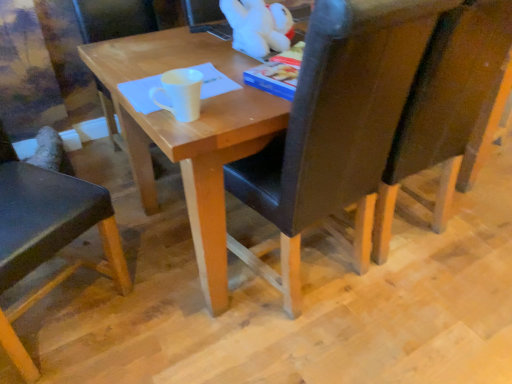
Image resolution: width=512 pixels, height=384 pixels. What do you see at coordinates (335, 130) in the screenshot?
I see `black leather chair at center, which is counted as the second chair, starting from the right` at bounding box center [335, 130].

Where is `matte wood chair at center, which ranks as the second chair in left-to-right order`? The image size is (512, 384). matte wood chair at center, which ranks as the second chair in left-to-right order is located at coordinates (125, 17).

Locate an element on the screen. dark brown leather chair at right, the first chair when ordered from right to left is located at coordinates (444, 108).

Can you confirm if white matte mug at center is bigger than matte wood chair at center, arranged as the 3th chair when viewed from the right?

Incorrect, white matte mug at center is not larger than matte wood chair at center, arranged as the 3th chair when viewed from the right.

Which object is positioned more to the left, white matte mug at center or matte wood chair at center, which ranks as the second chair in left-to-right order?

matte wood chair at center, which ranks as the second chair in left-to-right order, is more to the left.

What's the angular difference between white matte mug at center and matte wood chair at center, arranged as the 3th chair when viewed from the right,'s facing directions?

The angular difference between white matte mug at center and matte wood chair at center, arranged as the 3th chair when viewed from the right, is 86.4 degrees.

Is white matte mug at center completely or partially outside of matte wood chair at center, which ranks as the second chair in left-to-right order?

white matte mug at center is positioned outside matte wood chair at center, which ranks as the second chair in left-to-right order.

Who is bigger, matte wood chair at center, which ranks as the second chair in left-to-right order, or white matte mug at center?

matte wood chair at center, which ranks as the second chair in left-to-right order, is bigger.

Which is behind, matte wood chair at center, arranged as the 3th chair when viewed from the right, or white matte mug at center?

matte wood chair at center, arranged as the 3th chair when viewed from the right, is further from the camera.

Which is farther from the camera, (x=106, y=17) or (x=198, y=98)?

The point (x=106, y=17) is more distant.

From the picture: Is matte wood chair at center, which ranks as the second chair in left-to-right order, not near white matte mug at center?

Yes, matte wood chair at center, which ranks as the second chair in left-to-right order, and white matte mug at center are quite far apart.

Considering the sizes of objects black leather chair at center, the third chair viewed from the left, and matte black chair at left, the 4th chair from the right, in the image provided, who is wider, black leather chair at center, the third chair viewed from the left, or matte black chair at left, the 4th chair from the right,?

black leather chair at center, the third chair viewed from the left.

From a real-world perspective, which is physically above, black leather chair at center, the third chair viewed from the left, or matte black chair at left, the 4th chair from the right?

In real-world perspective, black leather chair at center, the third chair viewed from the left, is above.

Considering the positions of objects black leather chair at center, the third chair viewed from the left, and matte black chair at left, arranged as the 1th chair when viewed from the left, in the image provided, who is in front, black leather chair at center, the third chair viewed from the left, or matte black chair at left, arranged as the 1th chair when viewed from the left,?

matte black chair at left, arranged as the 1th chair when viewed from the left, is closer to the camera.

Considering the points (320, 59) and (16, 359), which point is in front, point (320, 59) or point (16, 359)?

The point (320, 59) is closer to the camera.

Does black leather chair at center, the third chair viewed from the left, come in front of white matte mug at center?

Yes, it is in front of white matte mug at center.

From the image's perspective, would you say black leather chair at center, the third chair viewed from the left, is shown under white matte mug at center?

Yes.

Which object is positioned more to the right, black leather chair at center, the third chair viewed from the left, or white matte mug at center?

black leather chair at center, the third chair viewed from the left, is more to the right.

Is matte wood chair at center, arranged as the 3th chair when viewed from the right, oriented towards black leather chair at center, which is counted as the second chair, starting from the right?

Yes, matte wood chair at center, arranged as the 3th chair when viewed from the right, faces towards black leather chair at center, which is counted as the second chair, starting from the right.

From the image's perspective, which is above, matte wood chair at center, which ranks as the second chair in left-to-right order, or black leather chair at center, the third chair viewed from the left?

From the image's view, matte wood chair at center, which ranks as the second chair in left-to-right order, is above.

From the picture: Are matte wood chair at center, which ranks as the second chair in left-to-right order, and black leather chair at center, the third chair viewed from the left, located far from each other?

Indeed, matte wood chair at center, which ranks as the second chair in left-to-right order, is not near black leather chair at center, the third chair viewed from the left.

From a real-world perspective, is matte wood chair at center, which ranks as the second chair in left-to-right order, located higher than black leather chair at center, which is counted as the second chair, starting from the right?

No, from a real-world perspective, matte wood chair at center, which ranks as the second chair in left-to-right order, is not on top of black leather chair at center, which is counted as the second chair, starting from the right.

From the image's perspective, would you say matte black chair at left, arranged as the 1th chair when viewed from the left, is positioned over dark brown leather chair at right, the fourth chair positioned from the left?

Incorrect, from the image's perspective, matte black chair at left, arranged as the 1th chair when viewed from the left, is lower than dark brown leather chair at right, the fourth chair positioned from the left.

Would you consider matte black chair at left, the 4th chair from the right, to be distant from dark brown leather chair at right, the first chair when ordered from right to left?

matte black chair at left, the 4th chair from the right, is far away from dark brown leather chair at right, the first chair when ordered from right to left.

Is matte black chair at left, the 4th chair from the right, to the left of dark brown leather chair at right, the fourth chair positioned from the left, from the viewer's perspective?

Yes.

Measure the distance between matte black chair at left, arranged as the 1th chair when viewed from the left, and dark brown leather chair at right, the first chair when ordered from right to left.

matte black chair at left, arranged as the 1th chair when viewed from the left, and dark brown leather chair at right, the first chair when ordered from right to left, are 1.15 meters apart from each other.

Between point (455, 179) and point (96, 264), which one is positioned behind?

Positioned behind is point (455, 179).

Which object is further away from the camera taking this photo, dark brown leather chair at right, the first chair when ordered from right to left, or matte black chair at left, arranged as the 1th chair when viewed from the left?

dark brown leather chair at right, the first chair when ordered from right to left, is behind.

Is dark brown leather chair at right, the fourth chair positioned from the left, turned away from matte black chair at left, arranged as the 1th chair when viewed from the left?

No, dark brown leather chair at right, the fourth chair positioned from the left, is not facing the opposite direction of matte black chair at left, arranged as the 1th chair when viewed from the left.

Considering the positions of objects dark brown leather chair at right, the fourth chair positioned from the left, and matte black chair at left, the 4th chair from the right, in the image provided, who is more to the left, dark brown leather chair at right, the fourth chair positioned from the left, or matte black chair at left, the 4th chair from the right,?

From the viewer's perspective, matte black chair at left, the 4th chair from the right, appears more on the left side.

Where is `coffee cup in front of the matte wood chair at center, arranged as the 3th chair when viewed from the right`? Image resolution: width=512 pixels, height=384 pixels. coffee cup in front of the matte wood chair at center, arranged as the 3th chair when viewed from the right is located at coordinates (181, 93).

Where is `chair that is the 1st object to the left of the white matte mug at center, starting at the anchor`? This screenshot has width=512, height=384. chair that is the 1st object to the left of the white matte mug at center, starting at the anchor is located at coordinates (125, 17).

Estimate the real-world distances between objects in this image. Which object is further from white plush toy at upper center, matte wood chair at center, arranged as the 3th chair when viewed from the right, or matte black chair at left, arranged as the 1th chair when viewed from the left?

Among the two, matte wood chair at center, arranged as the 3th chair when viewed from the right, is located further to white plush toy at upper center.

Based on their spatial positions, is matte black chair at left, arranged as the 1th chair when viewed from the left, or dark brown leather chair at right, the fourth chair positioned from the left, closer to white plush toy at upper center?

dark brown leather chair at right, the fourth chair positioned from the left, lies closer to white plush toy at upper center than the other object.

Which object lies nearer to the anchor point white matte mug at center, black leather chair at center, which is counted as the second chair, starting from the right, or dark brown leather chair at right, the first chair when ordered from right to left?

Based on the image, black leather chair at center, which is counted as the second chair, starting from the right, appears to be nearer to white matte mug at center.

Considering their positions, is white matte mug at center positioned closer to white plush toy at upper center than black leather chair at center, which is counted as the second chair, starting from the right?

The object closer to white plush toy at upper center is white matte mug at center.

Based on their spatial positions, is white plush toy at upper center or matte black chair at left, the 4th chair from the right, closer to black leather chair at center, the third chair viewed from the left?

white plush toy at upper center.

Based on their spatial positions, is dark brown leather chair at right, the first chair when ordered from right to left, or matte black chair at left, arranged as the 1th chair when viewed from the left, further from black leather chair at center, which is counted as the second chair, starting from the right?

Based on the image, matte black chair at left, arranged as the 1th chair when viewed from the left, appears to be further to black leather chair at center, which is counted as the second chair, starting from the right.

Considering their positions, is white plush toy at upper center positioned closer to dark brown leather chair at right, the fourth chair positioned from the left, than white matte mug at center?

white plush toy at upper center is positioned closer to the anchor dark brown leather chair at right, the fourth chair positioned from the left.

Based on their spatial positions, is white matte mug at center or matte black chair at left, the 4th chair from the right, closer to dark brown leather chair at right, the first chair when ordered from right to left?

white matte mug at center is positioned closer to the anchor dark brown leather chair at right, the first chair when ordered from right to left.

Where is `toy positioned between white matte mug at center and matte wood chair at center, which ranks as the second chair in left-to-right order, from near to far`? This screenshot has height=384, width=512. toy positioned between white matte mug at center and matte wood chair at center, which ranks as the second chair in left-to-right order, from near to far is located at coordinates (258, 26).

The height and width of the screenshot is (384, 512). I want to click on chair between matte wood chair at center, arranged as the 3th chair when viewed from the right, and dark brown leather chair at right, the fourth chair positioned from the left, from left to right, so click(335, 130).

Image resolution: width=512 pixels, height=384 pixels. Identify the location of toy positioned between black leather chair at center, which is counted as the second chair, starting from the right, and matte wood chair at center, arranged as the 3th chair when viewed from the right, from near to far. (258, 26).

Locate an element on the screen. chair between white plush toy at upper center and dark brown leather chair at right, the fourth chair positioned from the left, from left to right is located at coordinates (335, 130).